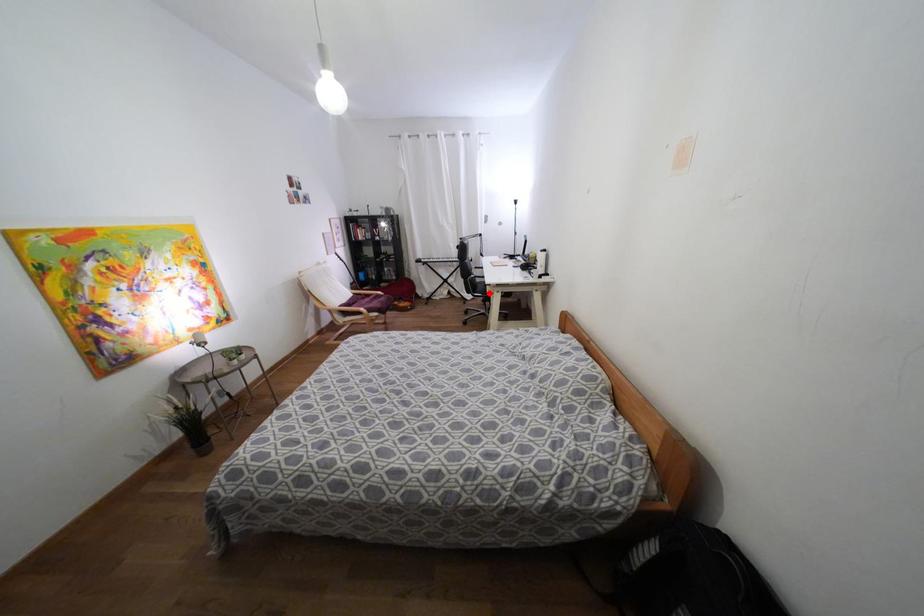
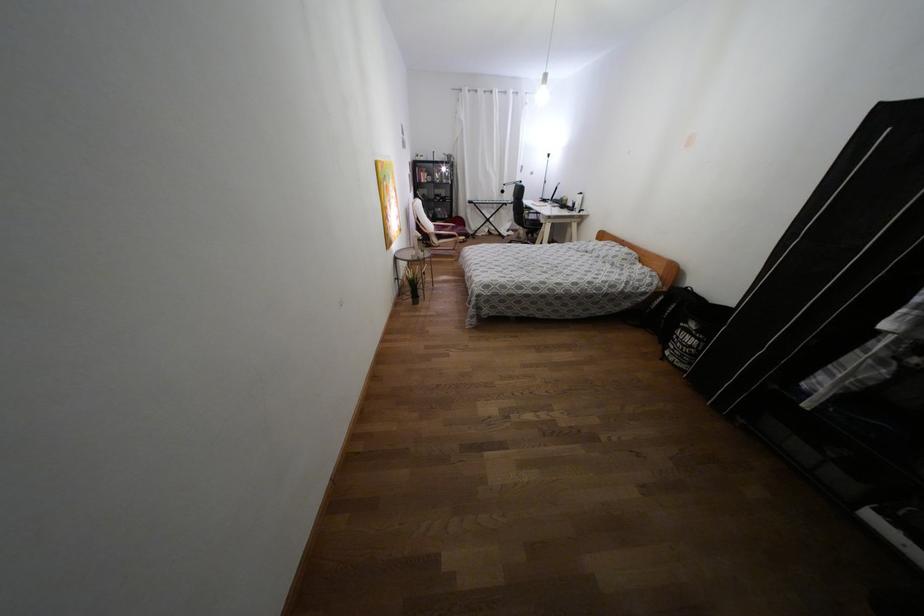
Question: I am providing you with two images of the same scene from different viewpoints. A red point is shown in image1. For the corresponding object point in image2, is it positioned nearer or farther from the camera?

Choices:
 (A) Nearer
 (B) Farther

Answer: (A)